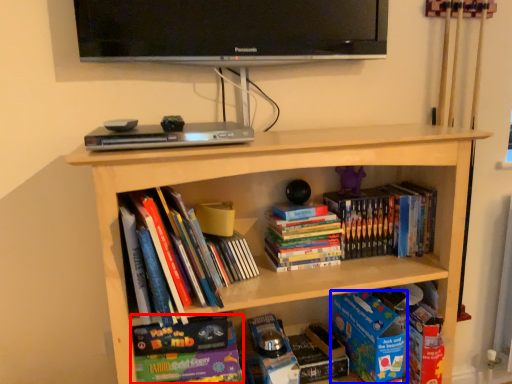
Question: Which point is further to the camera, book (highlighted by a red box) or paperback book (highlighted by a blue box)?

Choices:
 (A) book
 (B) paperback book

Answer: (B)